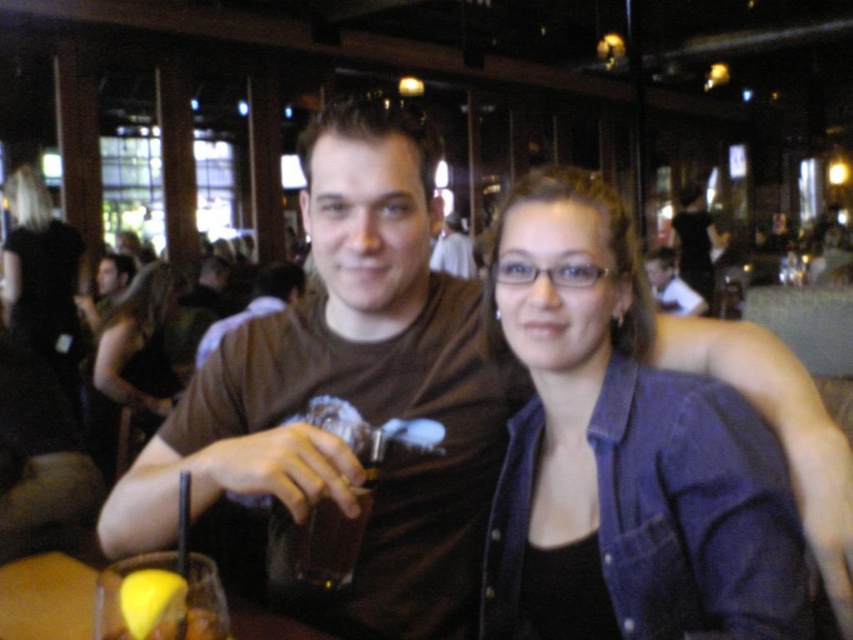
Question: Can you confirm if denim jacket at upper right is positioned to the left of matte brown shirt at center?

Choices:
 (A) no
 (B) yes

Answer: (B)

Question: Does black denim jacket at upper left have a larger size compared to matte black tank top at center?

Choices:
 (A) yes
 (B) no

Answer: (A)

Question: Which point is closer to the camera?

Choices:
 (A) matte black tank top at center
 (B) denim jacket at upper right

Answer: (B)

Question: Does translucent plastic cup at lower left have a larger size compared to matte black tank top at center?

Choices:
 (A) no
 (B) yes

Answer: (A)

Question: Which object is farther from the camera taking this photo?

Choices:
 (A) matte black tank top at center
 (B) translucent glass drink at center

Answer: (A)

Question: Which point is farther from the camera taking this photo?

Choices:
 (A) (36, 620)
 (B) (297, 561)
 (C) (33, 170)
 (D) (643, 296)

Answer: (C)